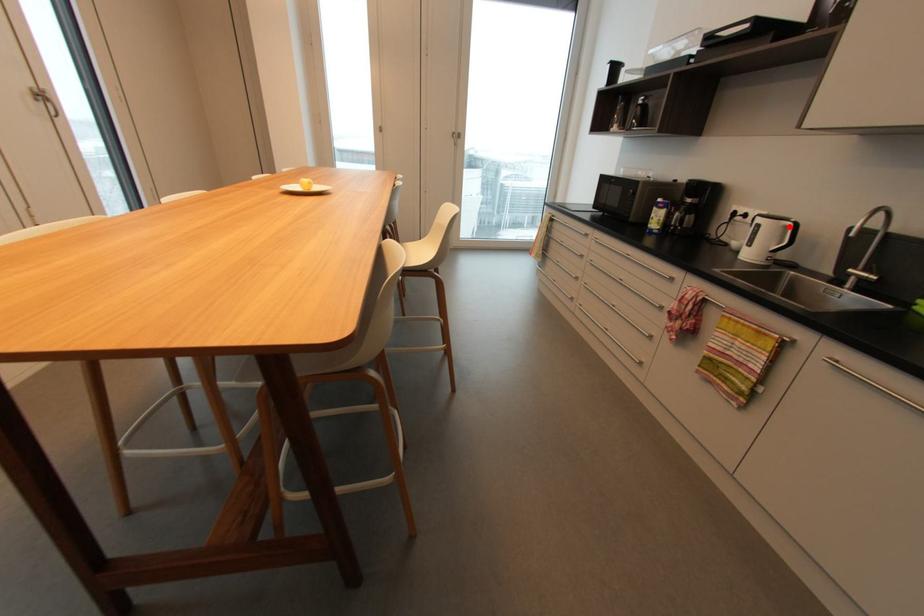
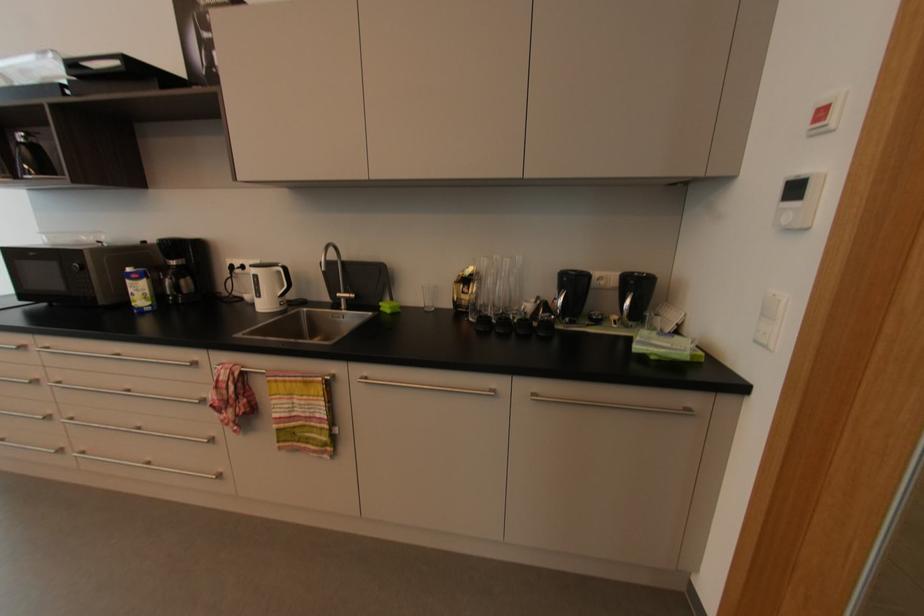
Locate, in the second image, the point that corresponds to the highlighted location in the first image.

(282, 273)